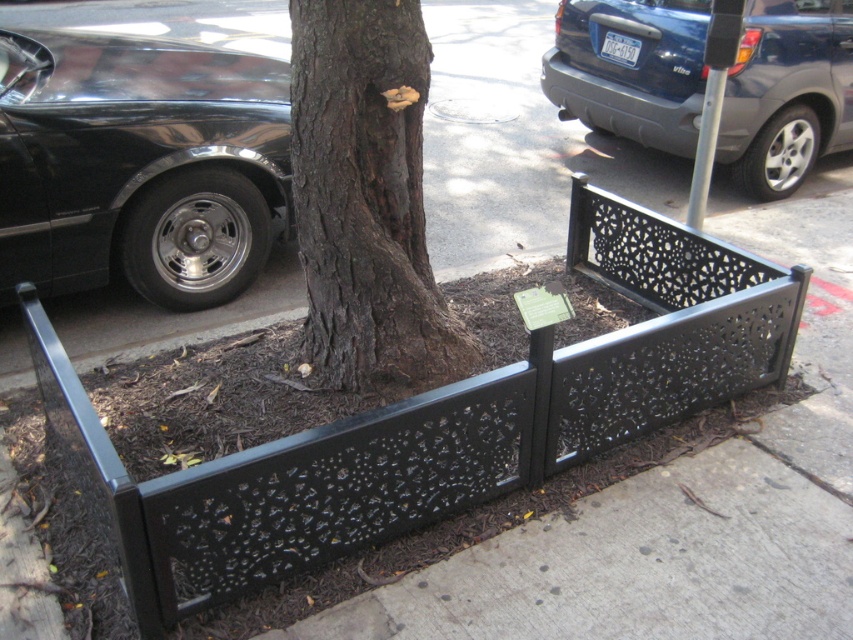
Does black perforated metal planter at center appear over shiny black car at left?

No.

Is point (184, 545) positioned after point (231, 144)?

No, it is in front of (231, 144).

Which is behind, point (573, 227) or point (154, 44)?

The point (154, 44) is behind.

Where is `black perforated metal planter at center`? The width and height of the screenshot is (853, 640). black perforated metal planter at center is located at coordinates (437, 420).

Is brown rough bark at center to the right of green matte plaque at center from the viewer's perspective?

Incorrect, brown rough bark at center is not on the right side of green matte plaque at center.

Is brown rough bark at center bigger than green matte plaque at center?

Correct, brown rough bark at center is larger in size than green matte plaque at center.

Find the location of a particular element. brown rough bark at center is located at coordinates (366, 198).

The height and width of the screenshot is (640, 853). What are the coordinates of `brown rough bark at center` in the screenshot? It's located at (366, 198).

Does metallic blue suv at upper right appear over black metal/texture curb at lower left?

Yes.

Can you confirm if metallic blue suv at upper right is bigger than black metal/texture curb at lower left?

Yes.

Is point (662, 8) closer to viewer compared to point (187, 342)?

No, (662, 8) is behind (187, 342).

At what (x,y) coordinates should I click in order to perform the action: click on metallic blue suv at upper right. Please return your answer as a coordinate pair (x, y). Looking at the image, I should click on (787, 93).